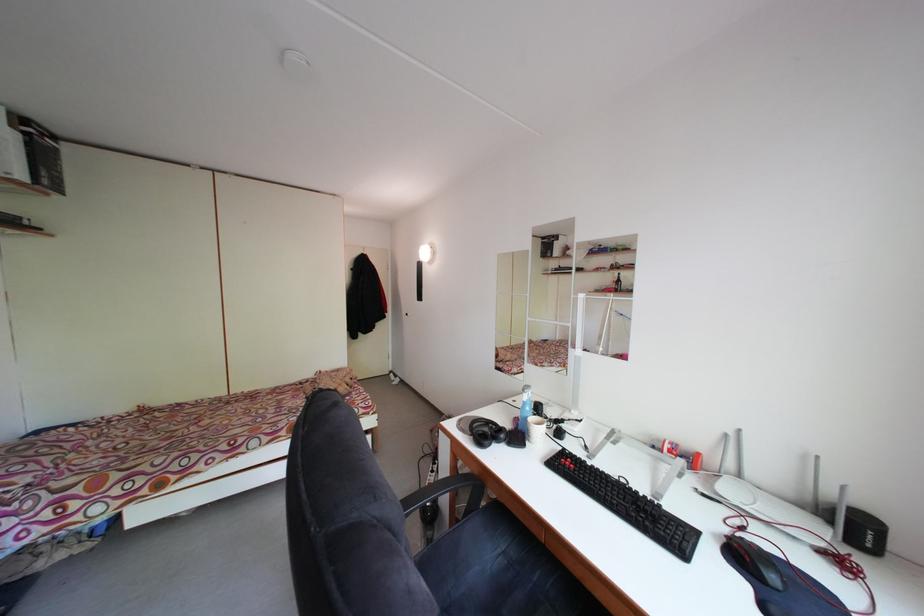
Find where to lift the blue spray bottle. Please return your answer as a coordinate pair (x, y).

(525, 408)